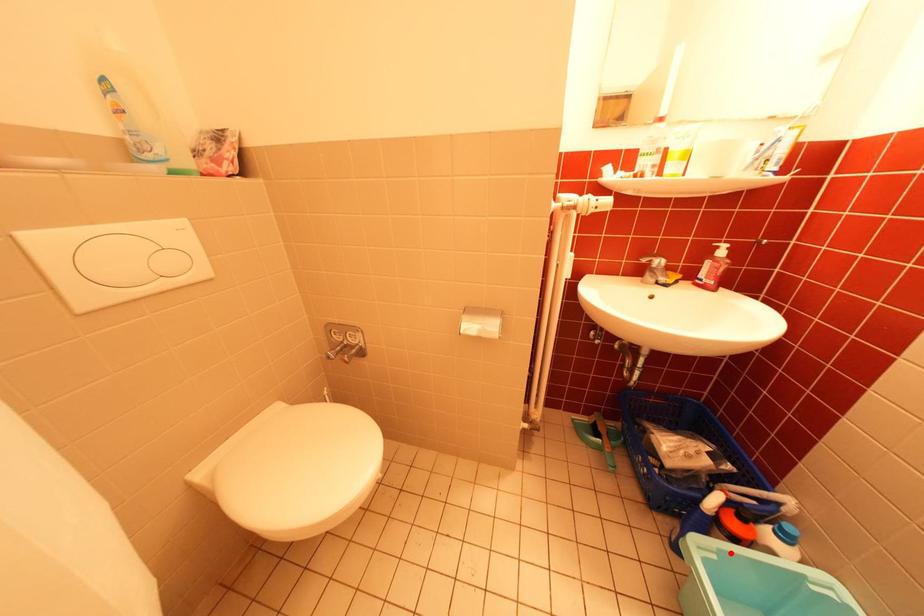
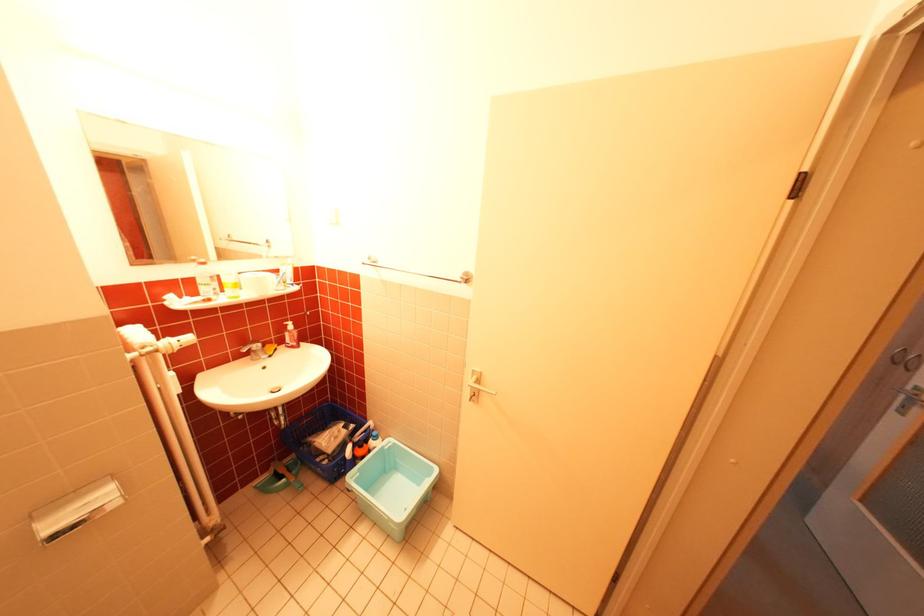
In the second image, find the point that corresponds to the highlighted location in the first image.

(370, 471)